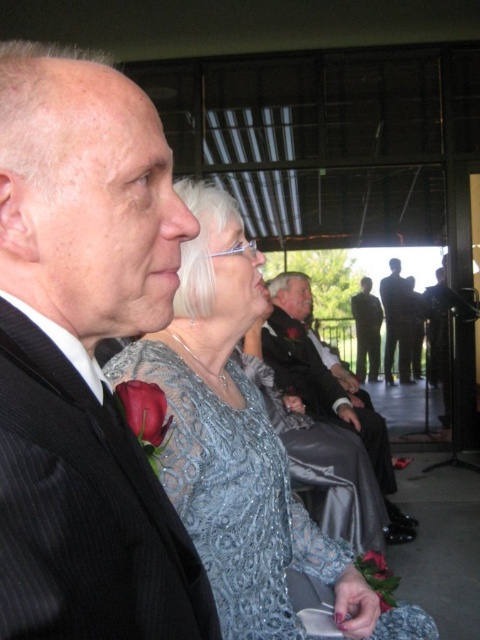
You are attending a formal event and notice two men in black suits. The first is wearing a black pinstripe suit at left, and the second is wearing a shiny black suit at center. From your perspective, which suit is closer to you?

The black pinstripe suit at left is positioned over the shiny black suit at center, meaning it is closer to you.

You are standing at the back of the room and want to take a photo of both the point at coordinates point (12, 595) and point (253, 260). Which point should you adjust your camera focus to first to ensure both are in the frame?

You should focus on point (253, 260) first because it is further back than point (12, 595), ensuring both are within the camera frame when adjusted properly.

You are a photographer at the event and need to capture a closeup shot of the black pinstripe suit at left and the woman in the silver grey lace gown next to him. The camera you have can only focus on objects within 15 inches of each other. Will you be able to capture both in focus?

The black pinstripe suit at left and the woman in the silver grey lace gown next to him are 15.05 inches apart. Since the camera can only focus on objects within 15 inches of each other, the distance is slightly too far, so the camera cannot focus both in the same shot.